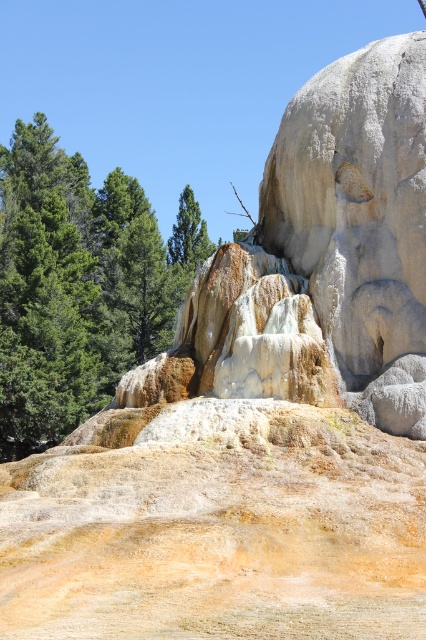
Is green textured pine trees at left wider than green matte tree at center?

Yes.

Does point (183, 296) come in front of point (198, 252)?

Yes, point (183, 296) is in front of point (198, 252).

Locate an element on the screen. This screenshot has height=640, width=426. green textured pine trees at left is located at coordinates (78, 285).